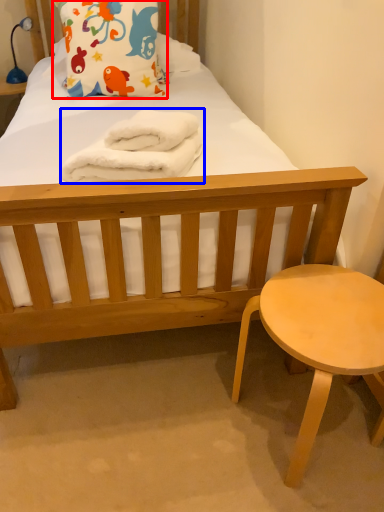
Question: Among these objects, which one is farthest to the camera, pillow (highlighted by a red box) or material (highlighted by a blue box)?

Choices:
 (A) pillow
 (B) material

Answer: (A)